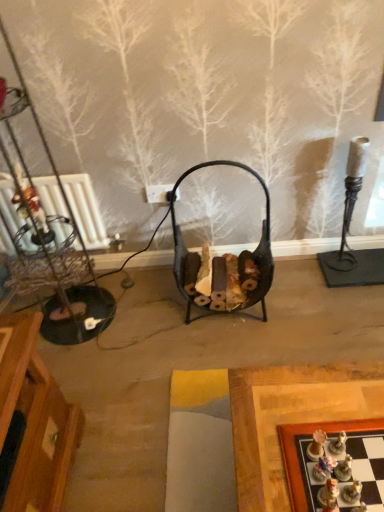
This screenshot has height=512, width=384. What are the coordinates of `free location to the left of black metal basket at center` in the screenshot? It's located at (150, 311).